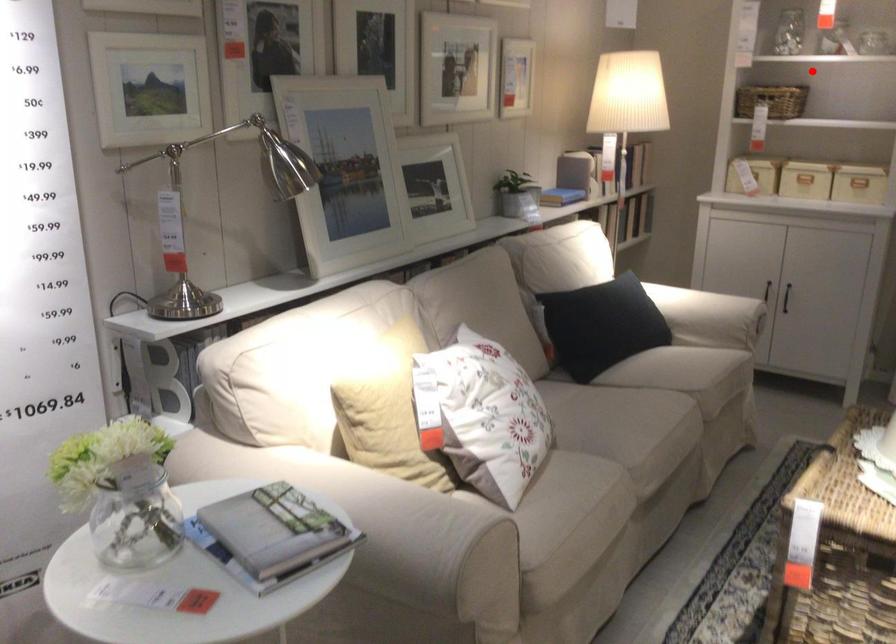
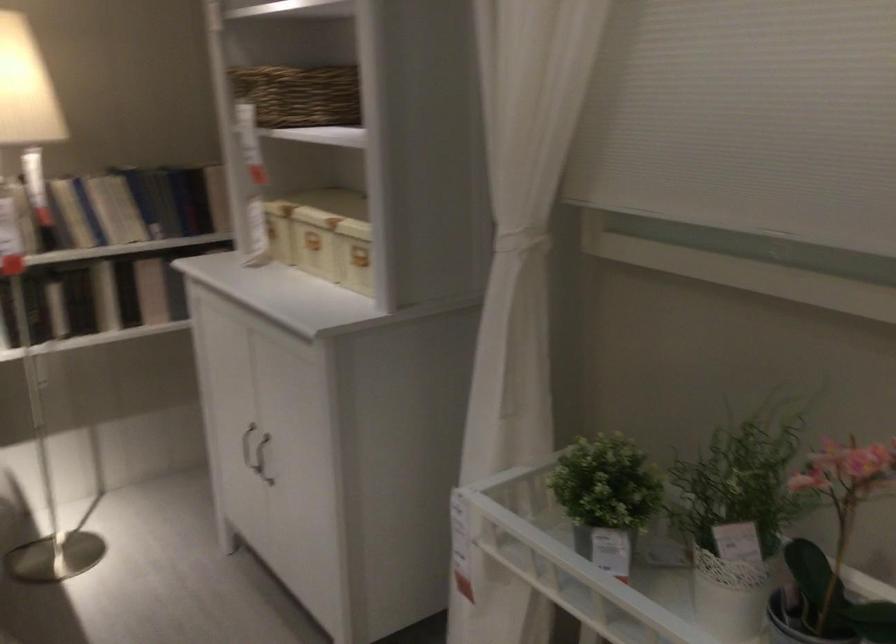
In the second image, find the point that corresponds to the highlighted location in the first image.

(298, 93)